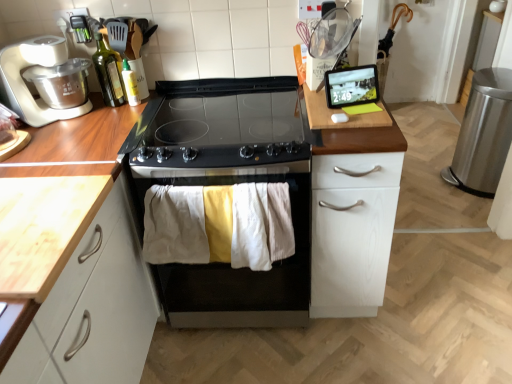
Question: Does green glass bottle at upper left, the 1th bottle in the left-to-right sequence, have a greater width compared to black stainless steel oven at center?

Choices:
 (A) no
 (B) yes

Answer: (A)

Question: Does green glass bottle at upper left, the 2th bottle positioned from the right, lie behind black stainless steel oven at center?

Choices:
 (A) no
 (B) yes

Answer: (B)

Question: Is green glass bottle at upper left, the 2th bottle positioned from the right, next to black stainless steel oven at center?

Choices:
 (A) yes
 (B) no

Answer: (B)

Question: Is green glass bottle at upper left, the 2th bottle positioned from the right, positioned in front of black stainless steel oven at center?

Choices:
 (A) no
 (B) yes

Answer: (A)

Question: Could you tell me if green glass bottle at upper left, the 1th bottle in the left-to-right sequence, is facing black stainless steel oven at center?

Choices:
 (A) yes
 (B) no

Answer: (B)

Question: From a real-world perspective, is green glass bottle at upper left, the 1th bottle in the left-to-right sequence, on top of black stainless steel oven at center?

Choices:
 (A) no
 (B) yes

Answer: (B)

Question: Is light wood countertop at left completely or partially outside of matte black tablet at upper right?

Choices:
 (A) no
 (B) yes

Answer: (B)

Question: Considering the relative positions of light wood countertop at left and matte black tablet at upper right in the image provided, is light wood countertop at left to the left of matte black tablet at upper right from the viewer's perspective?

Choices:
 (A) no
 (B) yes

Answer: (B)

Question: From a real-world perspective, is light wood countertop at left over matte black tablet at upper right?

Choices:
 (A) no
 (B) yes

Answer: (A)

Question: Considering the relative sizes of light wood countertop at left and matte black tablet at upper right in the image provided, is light wood countertop at left shorter than matte black tablet at upper right?

Choices:
 (A) yes
 (B) no

Answer: (A)

Question: Is light wood countertop at left further to camera compared to matte black tablet at upper right?

Choices:
 (A) no
 (B) yes

Answer: (A)

Question: Considering the relative sizes of light wood countertop at left and matte black tablet at upper right in the image provided, is light wood countertop at left thinner than matte black tablet at upper right?

Choices:
 (A) yes
 (B) no

Answer: (B)

Question: Does white matte food processor at left have a larger size compared to black stainless steel oven at center?

Choices:
 (A) yes
 (B) no

Answer: (B)